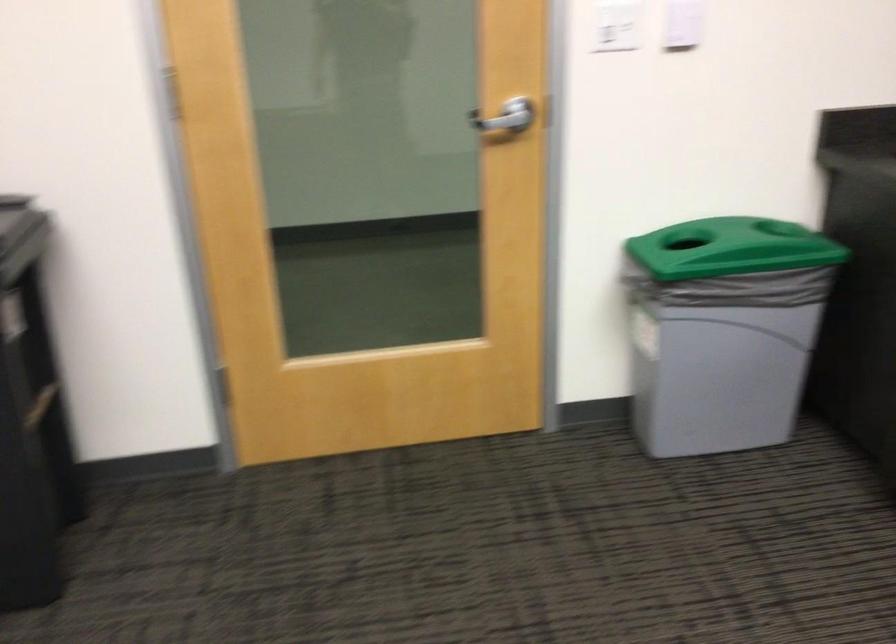
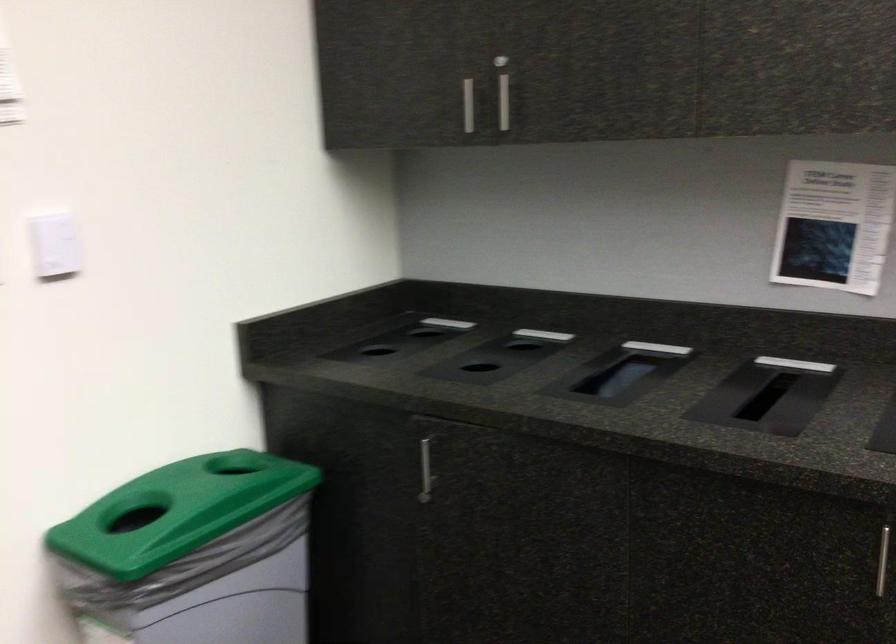
Question: The camera is either moving clockwise (left) or counter-clockwise (right) around the object. The first image is from the beginning of the video and the second image is from the end. Is the camera moving left or right when shooting the video?

Choices:
 (A) Left
 (B) Right

Answer: (A)